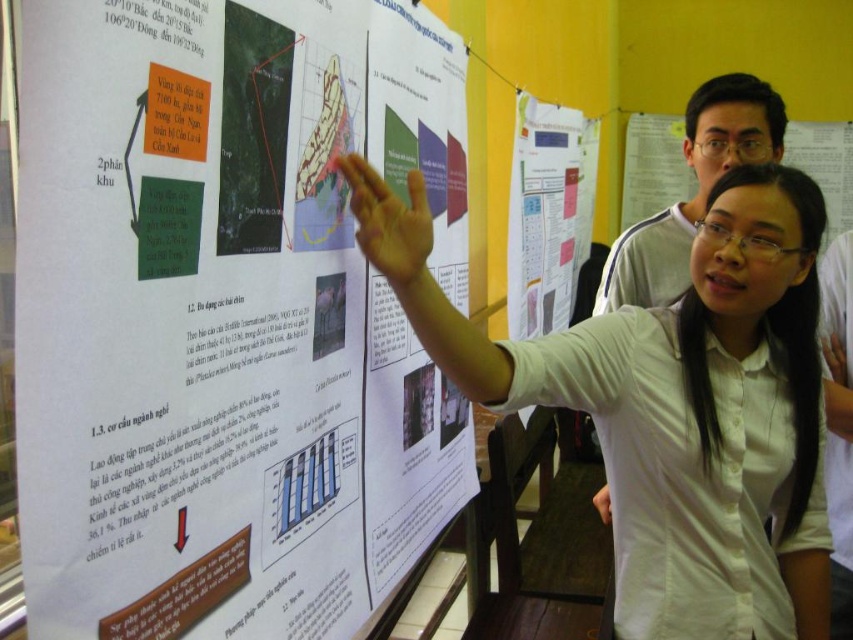
Looking at this image, you are an attendee at a conference and see the white paper poster at center and the white paper at center. Which one is taller?

The white paper poster at center is taller than the white paper at center.

You are an attendee at this presentation. You notice the white shirt at center and the white paper at center. Which one is closer to you?

The white shirt at center is closer to you because it is in front of the white paper at center.